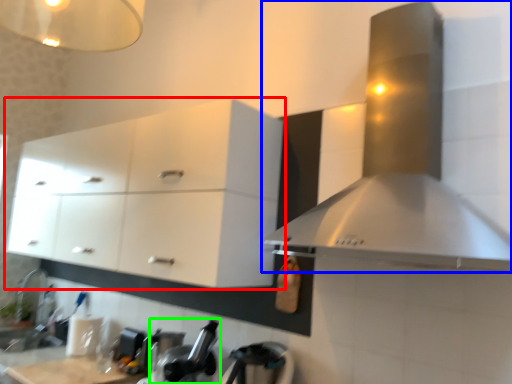
Question: Estimate the real-world distances between objects in this image. Which object is farther from cabinetry (highlighted by a red box), home appliance (highlighted by a blue box) or appliance (highlighted by a green box)?

Choices:
 (A) home appliance
 (B) appliance

Answer: (A)